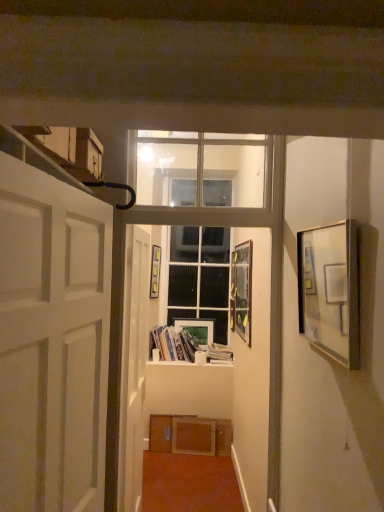
What do you see at coordinates (155, 271) in the screenshot?
I see `matte gold picture frame at center, the third picture frame from the front` at bounding box center [155, 271].

Image resolution: width=384 pixels, height=512 pixels. Identify the location of matte gold picture frame at center, the 1th picture frame from the left. (155, 271).

The width and height of the screenshot is (384, 512). Describe the element at coordinates (200, 276) in the screenshot. I see `white wood window frame at center, the first window frame when ordered from bottom to top` at that location.

Measure the distance between white paper book at center, the first book in the right-to-left sequence, and camera.

The distance of white paper book at center, the first book in the right-to-left sequence, from camera is 3.93 meters.

Describe the element at coordinates (134, 365) in the screenshot. I see `white matte door at center, positioned as the second door in front-to-back order` at that location.

How much space does matte paper books at center, which appears as the first book when viewed from the left, occupy vertically?

matte paper books at center, which appears as the first book when viewed from the left, is 32.40 centimeters in height.

This screenshot has width=384, height=512. I want to click on matte gold picture frame at center, acting as the 2th picture frame starting from the back, so click(x=155, y=271).

Is clear glass window at upper center, the 2th window frame in the bottom-to-top sequence, aimed at white paper book at center, which ranks as the 2th book in left-to-right order?

No, clear glass window at upper center, the 2th window frame in the bottom-to-top sequence, is not oriented towards white paper book at center, which ranks as the 2th book in left-to-right order.

Which object is wider, clear glass window at upper center, which is the 1th window frame in top-to-bottom order, or white paper book at center, which ranks as the 2th book in left-to-right order?

white paper book at center, which ranks as the 2th book in left-to-right order.

Is clear glass window at upper center, positioned as the first window frame in front-to-back order, next to white paper book at center, the first book in the right-to-left sequence?

No, clear glass window at upper center, positioned as the first window frame in front-to-back order, is not next to white paper book at center, the first book in the right-to-left sequence.

Based on their sizes in the image, would you say clear glass window at upper center, positioned as the first window frame in front-to-back order, is bigger or smaller than white paper book at center, the first book in the right-to-left sequence?

Clearly, clear glass window at upper center, positioned as the first window frame in front-to-back order, is larger in size than white paper book at center, the first book in the right-to-left sequence.

Does matte glass picture frame at right, which is the first picture frame in front-to-back order, come behind matte paper books at center, which appears as the first book when viewed from the left?

No, matte glass picture frame at right, which is the first picture frame in front-to-back order, is closer to the camera.

Who is taller, matte glass picture frame at right, placed as the fourth picture frame when sorted from back to front, or matte paper books at center, the second book viewed from the right?

matte glass picture frame at right, placed as the fourth picture frame when sorted from back to front, is taller.

From the image's perspective, is matte glass picture frame at right, which is the first picture frame in front-to-back order, located beneath matte paper books at center, the second book viewed from the right?

Incorrect, from the image's perspective, matte glass picture frame at right, which is the first picture frame in front-to-back order, is higher than matte paper books at center, the second book viewed from the right.

Can you confirm if white wood window frame at center, positioned as the second window frame in front-to-back order, is shorter than matte paper books at center, the second book viewed from the right?

Incorrect, the height of white wood window frame at center, positioned as the second window frame in front-to-back order, does not fall short of that of matte paper books at center, the second book viewed from the right.

Based on the photo, could you tell me if white wood window frame at center, positioned as the second window frame in front-to-back order, is turned towards matte paper books at center, the second book viewed from the right?

Yes, white wood window frame at center, positioned as the second window frame in front-to-back order, is turned towards matte paper books at center, the second book viewed from the right.

Considering the sizes of objects white wood window frame at center, placed as the second window frame when sorted from top to bottom, and matte paper books at center, the second book viewed from the right, in the image provided, who is bigger, white wood window frame at center, placed as the second window frame when sorted from top to bottom, or matte paper books at center, the second book viewed from the right,?

Bigger between the two is white wood window frame at center, placed as the second window frame when sorted from top to bottom.

You are a GUI agent. You are given a task and a screenshot of the screen. Output one action in this format:
    pyautogui.click(x=<x>, y=<y>)
    Task: Click on the 2nd book in front of the white wood window frame at center, positioned as the second window frame in front-to-back order, counting from the anchor's position
    Image resolution: width=384 pixels, height=512 pixels.
    Given the screenshot: What is the action you would take?
    pyautogui.click(x=184, y=346)

From the image's perspective, which is below, wooden at center or matte glass picture frame at center, the 3th picture frame viewed from the back?

wooden at center appears lower in the image.

From a real-world perspective, which object rests below the other?

From a 3D spatial view, wooden at center is below.

Which of these two, wooden at center or matte glass picture frame at center, which is the 3th picture frame from left to right, is smaller?

Smaller between the two is wooden at center.

Would you say wooden at center is a long distance from matte glass picture frame at center, the 3th picture frame viewed from the back?

No, wooden at center is not far away from matte glass picture frame at center, the 3th picture frame viewed from the back.

Is white matte door at center, positioned as the second door in front-to-back order, next to matte wooden picture frame at center, the 4th picture frame in the front-to-back sequence, and touching it?

white matte door at center, positioned as the second door in front-to-back order, and matte wooden picture frame at center, the 4th picture frame in the front-to-back sequence, are clearly separated.

How far apart are white matte door at center, positioned as the second door in front-to-back order, and matte wooden picture frame at center, arranged as the third picture frame when viewed from the right?

5.01 feet.

Does white matte door at center, positioned as the second door in front-to-back order, appear on the right side of matte wooden picture frame at center, placed as the 1th picture frame when sorted from back to front?

No, white matte door at center, positioned as the second door in front-to-back order, is not to the right of matte wooden picture frame at center, placed as the 1th picture frame when sorted from back to front.

From the image's perspective, count 1st doors upward from the matte wooden picture frame at center, arranged as the third picture frame when viewed from the right, and point to it. Please provide its 2D coordinates.

[(134, 365)]

Which is closer to the camera, (197, 262) or (250, 286)?

Point (197, 262) is farther from the camera than point (250, 286).

Is white wood window frame at center, placed as the second window frame when sorted from top to bottom, facing towards matte glass picture frame at center, which is the 3th picture frame from left to right?

Yes, white wood window frame at center, placed as the second window frame when sorted from top to bottom, faces towards matte glass picture frame at center, which is the 3th picture frame from left to right.

Which is more to the right, white wood window frame at center, positioned as the second window frame in front-to-back order, or matte glass picture frame at center, the second picture frame positioned from the right?

matte glass picture frame at center, the second picture frame positioned from the right.

Is white wood window frame at center, the first window frame when ordered from bottom to top, bigger than matte glass picture frame at center, placed as the 2th picture frame when sorted from front to back?

Yes.

Which of these two, wooden at center or white matte door at center, positioned as the second door in front-to-back order, is smaller?

wooden at center is smaller.

Which is closer to the camera, [223,362] or [143,278]?

Point [223,362] is farther from the camera than point [143,278].

Is wooden at center to the right of white matte door at center, the first door from the back, from the viewer's perspective?

Correct, you'll find wooden at center to the right of white matte door at center, the first door from the back.

From the image's perspective, who appears lower, wooden at center or white matte door at center, the first door from the back?

wooden at center appears lower in the image.

The height and width of the screenshot is (512, 384). What are the coordinates of `window frame in front of the white paper book at center, the first book in the right-to-left sequence` in the screenshot? It's located at (205, 180).

What are the coordinates of `the 2nd book to the left when counting from the matte glass picture frame at right, which is counted as the 1th picture frame, starting from the right` in the screenshot? It's located at (184, 346).

Based on their spatial positions, is clear glass window at upper center, positioned as the first window frame in front-to-back order, or matte glass picture frame at right, placed as the fourth picture frame when sorted from back to front, further from white wood window frame at center, positioned as the second window frame in front-to-back order?

Among the two, matte glass picture frame at right, placed as the fourth picture frame when sorted from back to front, is located further to white wood window frame at center, positioned as the second window frame in front-to-back order.

When comparing their distances from white wood window frame at center, which appears as the 1th window frame when viewed from the back, does matte wooden picture frame at center, placed as the 1th picture frame when sorted from back to front, or white matte door at left, which is counted as the second door, starting from the back, seem closer?

Based on the image, matte wooden picture frame at center, placed as the 1th picture frame when sorted from back to front, appears to be nearer to white wood window frame at center, which appears as the 1th window frame when viewed from the back.

Which object lies further to the anchor point matte wooden picture frame at center, positioned as the 2th picture frame in left-to-right order, matte gold picture frame at center, acting as the 2th picture frame starting from the back, or matte glass picture frame at center, placed as the 2th picture frame when sorted from front to back?

Based on the image, matte glass picture frame at center, placed as the 2th picture frame when sorted from front to back, appears to be further to matte wooden picture frame at center, positioned as the 2th picture frame in left-to-right order.

Consider the image. Looking at the image, which one is located further to matte paper books at center, the second book viewed from the right, matte wooden picture frame at center, placed as the 1th picture frame when sorted from back to front, or white wood window frame at center, the first window frame when ordered from bottom to top?

Among the two, white wood window frame at center, the first window frame when ordered from bottom to top, is located further to matte paper books at center, the second book viewed from the right.

Estimate the real-world distances between objects in this image. Which object is closer to white wood window frame at center, the first window frame when ordered from bottom to top, wooden at center or matte glass picture frame at right, placed as the fourth picture frame when sorted from back to front?

Among the two, wooden at center is located nearer to white wood window frame at center, the first window frame when ordered from bottom to top.

Considering their positions, is matte wooden picture frame at center, placed as the 1th picture frame when sorted from back to front, positioned closer to matte glass picture frame at center, placed as the 2th picture frame when sorted from front to back, than matte glass picture frame at right, which is the first picture frame in front-to-back order?

matte wooden picture frame at center, placed as the 1th picture frame when sorted from back to front, is positioned closer to the anchor matte glass picture frame at center, placed as the 2th picture frame when sorted from front to back.

Considering their positions, is white matte door at center, the first door from the back, positioned closer to white matte door at left, which is counted as the second door, starting from the back, than matte paper books at center, the second book viewed from the right?

white matte door at center, the first door from the back, lies closer to white matte door at left, which is counted as the second door, starting from the back, than the other object.

Which object lies nearer to the anchor point matte glass picture frame at center, placed as the 2th picture frame when sorted from front to back, wooden at center or white matte door at center, positioned as the second door in front-to-back order?

The object closer to matte glass picture frame at center, placed as the 2th picture frame when sorted from front to back, is white matte door at center, positioned as the second door in front-to-back order.

Locate an element on the screen. door between clear glass window at upper center, the 2th window frame in the back-to-front sequence, and matte paper books at center, the second book viewed from the right, along the z-axis is located at coordinates [x=134, y=365].

At what (x,y) coordinates should I click in order to perform the action: click on window frame that lies between matte gold picture frame at center, acting as the 2th picture frame starting from the back, and matte wooden picture frame at center, placed as the 1th picture frame when sorted from back to front, from top to bottom. Please return your answer as a coordinate pair (x, y). Looking at the image, I should click on 200,276.

Locate an element on the screen. window sill positioned between matte glass picture frame at right, which is counted as the 1th picture frame, starting from the right, and white wood window frame at center, which appears as the 1th window frame when viewed from the back, from near to far is located at coordinates (221, 362).

The width and height of the screenshot is (384, 512). Find the location of `window sill positioned between white matte door at left, the 1th door from the front, and matte paper books at center, which appears as the first book when viewed from the left, from near to far`. window sill positioned between white matte door at left, the 1th door from the front, and matte paper books at center, which appears as the first book when viewed from the left, from near to far is located at coordinates (221, 362).